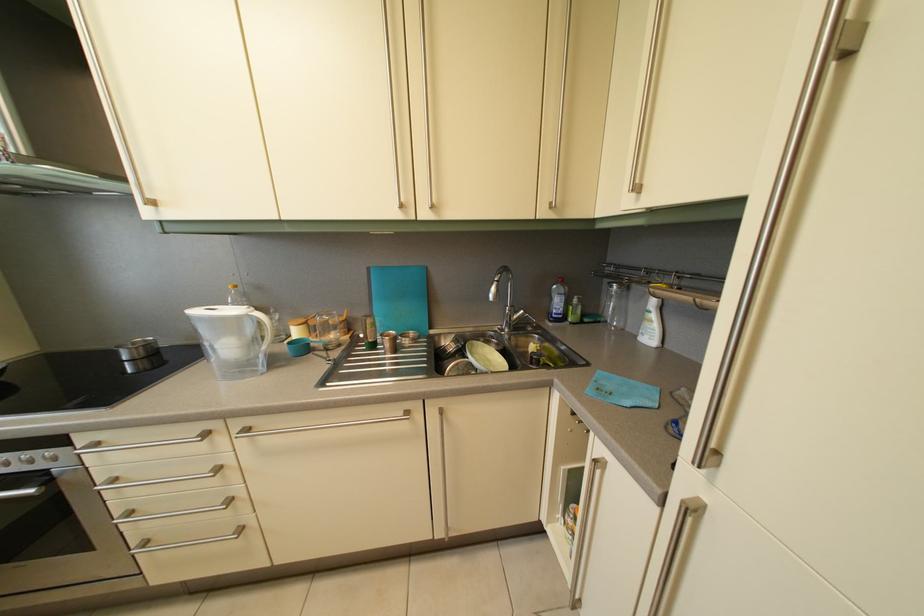
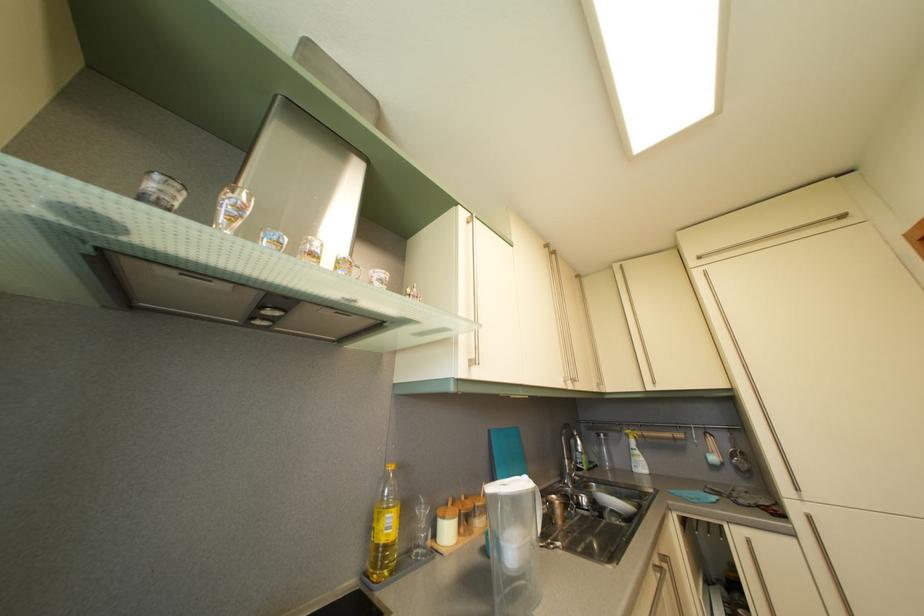
Locate, in the second image, the point that corresponds to (x=619, y=294) in the first image.

(608, 444)